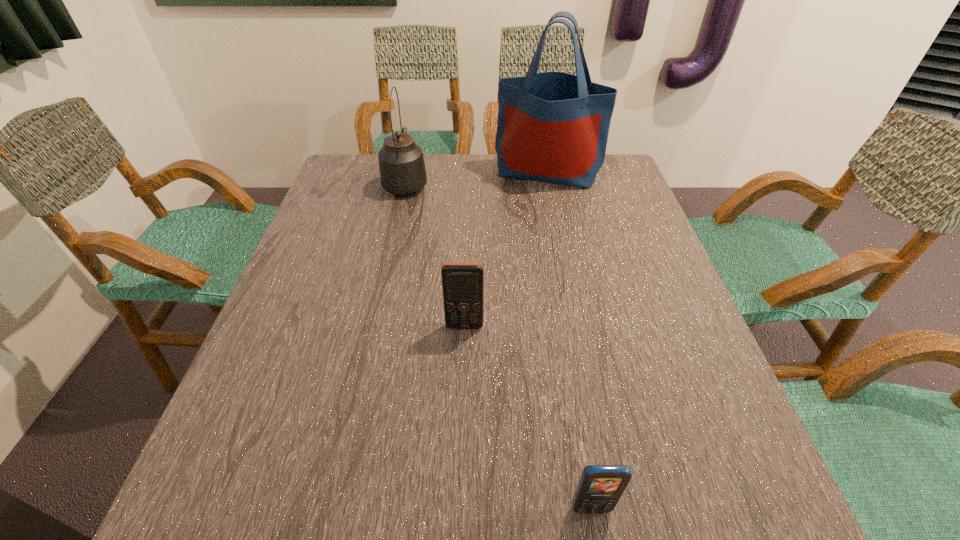
This screenshot has height=540, width=960. Identify the location of the tallest object. tap(552, 127).

What are the coordinates of `the leftmost object` in the screenshot? It's located at click(402, 169).

The image size is (960, 540). Find the location of `kettle`. kettle is located at coordinates (402, 169).

Where is `the third tallest object`? Image resolution: width=960 pixels, height=540 pixels. the third tallest object is located at coordinates (462, 283).

Where is `the second nearest object`? This screenshot has width=960, height=540. the second nearest object is located at coordinates (462, 283).

Identify the location of the nearest object. (600, 487).

In order to click on the nearer cellular telephone in this screenshot , I will do `click(600, 487)`.

The image size is (960, 540). I want to click on free spot located on the left of the tallest object, so click(x=446, y=172).

Locate an element on the screen. This screenshot has width=960, height=540. vacant space situated spout on the kettle is located at coordinates (412, 156).

What are the coordinates of `free location located 0.130m on the screen of the farther cellular telephone` in the screenshot? It's located at (463, 385).